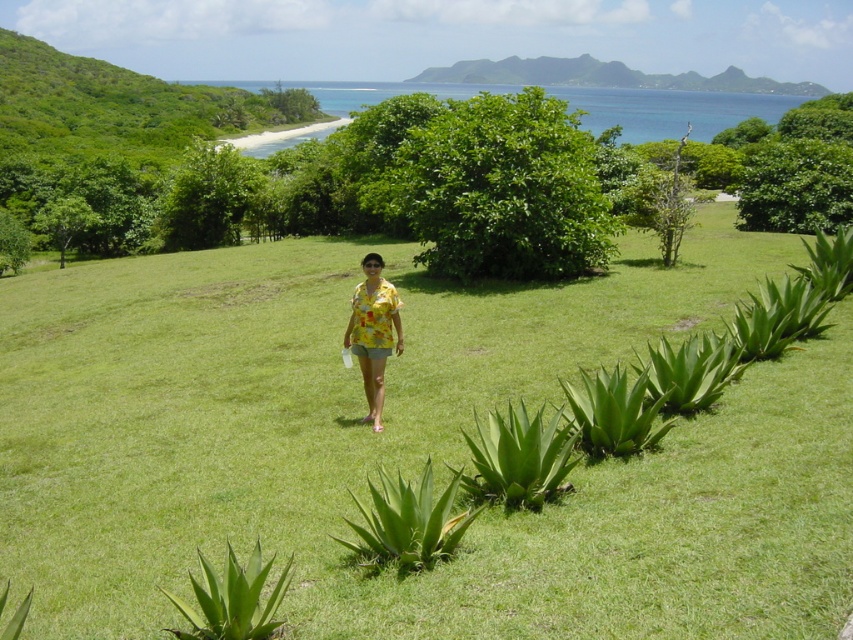
Question: Is green grassy at center wider than green leafy hillside at upper center?

Choices:
 (A) yes
 (B) no

Answer: (B)

Question: Is green grassy at center thinner than green leafy hillside at upper center?

Choices:
 (A) no
 (B) yes

Answer: (B)

Question: Among these points, which one is farthest from the camera?

Choices:
 (A) (451, 74)
 (B) (381, 609)

Answer: (A)

Question: Which point is closer to the camera?

Choices:
 (A) green grassy at center
 (B) yellow printed blouse at center
 (C) green leafy hillside at upper center

Answer: (A)

Question: Which of these objects is positioned closest to the yellow printed blouse at center?

Choices:
 (A) green leafy hillside at upper center
 (B) green grassy at center

Answer: (B)

Question: Can you confirm if green leafy hillside at upper center is positioned below yellow printed blouse at center?

Choices:
 (A) yes
 (B) no

Answer: (B)